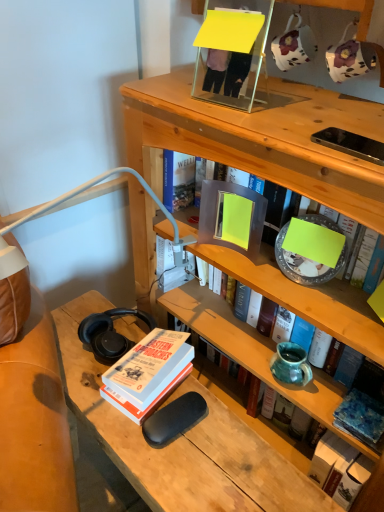
What do you see at coordinates (291, 364) in the screenshot? I see `teal ceramic vase at middle right` at bounding box center [291, 364].

In order to face teal ceramic vase at middle right, should I rotate leftwards or rightwards?

Rotate right and turn 13.394 degrees.

The image size is (384, 512). What do you see at coordinates (361, 417) in the screenshot?
I see `blue textured fabric at lower right, placed as the first book when sorted from bottom to top` at bounding box center [361, 417].

What do you see at coordinates (147, 372) in the screenshot? I see `hardcover book at lower left, which is the 3th book in top-to-bottom order` at bounding box center [147, 372].

What do you see at coordinates (223, 342) in the screenshot?
I see `hardcover book at upper center, which is counted as the 2th book, starting from the top` at bounding box center [223, 342].

Where is `matte gray book at center, arranged as the first book when viewed from the top`? The height and width of the screenshot is (512, 384). matte gray book at center, arranged as the first book when viewed from the top is located at coordinates (153, 168).

From a real-world perspective, is teal ceramic vase at middle right positioned over hardcover book at lower left, which is the 3th book in top-to-bottom order, based on gravity?

Indeed, from a real-world perspective, teal ceramic vase at middle right stands above hardcover book at lower left, which is the 3th book in top-to-bottom order.

From the image's perspective, starting from the teal ceramic vase at middle right, which book is the 1st one below? Please provide its 2D coordinates.

[(147, 372)]

Which is behind, point (279, 344) or point (157, 341)?

Positioned behind is point (279, 344).

Considering the relative positions of hardcover book at lower left, which is the 3th book in top-to-bottom order, and blue textured fabric at lower right, marked as the 4th book in a top-to-bottom arrangement, in the image provided, is hardcover book at lower left, which is the 3th book in top-to-bottom order, in front of blue textured fabric at lower right, marked as the 4th book in a top-to-bottom arrangement,?

No, the depth of hardcover book at lower left, which is the 3th book in top-to-bottom order, is greater than that of blue textured fabric at lower right, marked as the 4th book in a top-to-bottom arrangement.

Which of these two, hardcover book at lower left, acting as the 2th book starting from the bottom, or blue textured fabric at lower right, marked as the 4th book in a top-to-bottom arrangement, stands shorter?

Standing shorter between the two is blue textured fabric at lower right, marked as the 4th book in a top-to-bottom arrangement.

From the image's perspective, who appears lower, hardcover book at lower left, acting as the 2th book starting from the bottom, or blue textured fabric at lower right, placed as the first book when sorted from bottom to top?

blue textured fabric at lower right, placed as the first book when sorted from bottom to top, from the image's perspective.

Is blue textured fabric at lower right, marked as the 4th book in a top-to-bottom arrangement, surrounded by hardcover book at lower left, which is the 3th book in top-to-bottom order?

Actually, blue textured fabric at lower right, marked as the 4th book in a top-to-bottom arrangement, is outside hardcover book at lower left, which is the 3th book in top-to-bottom order.

Is the depth of hardcover book at upper center, which is counted as the 2th book, starting from the top, less than that of teal ceramic vase at middle right?

Yes, hardcover book at upper center, which is counted as the 2th book, starting from the top, is in front of teal ceramic vase at middle right.

Identify the location of vase on the right of hardcover book at upper center, which is the third book in bottom-to-top order. The image size is (384, 512). (291, 364).

Is hardcover book at upper center, which is counted as the 2th book, starting from the top, facing away from teal ceramic vase at middle right?

Yes, hardcover book at upper center, which is counted as the 2th book, starting from the top, is positioned with its back facing teal ceramic vase at middle right.

Is hardcover book at upper center, which is the third book in bottom-to-top order, shorter than teal ceramic vase at middle right?

No, hardcover book at upper center, which is the third book in bottom-to-top order, is not shorter than teal ceramic vase at middle right.

Is hardcover book at lower left, acting as the 2th book starting from the bottom, bigger than hardcover book at upper center, which is counted as the 2th book, starting from the top?

Incorrect, hardcover book at lower left, acting as the 2th book starting from the bottom, is not larger than hardcover book at upper center, which is counted as the 2th book, starting from the top.

Is the position of hardcover book at lower left, acting as the 2th book starting from the bottom, more distant than that of hardcover book at upper center, which is counted as the 2th book, starting from the top?

Yes, hardcover book at lower left, acting as the 2th book starting from the bottom, is further from the camera.

From the image's perspective, which one is positioned lower, hardcover book at lower left, which is the 3th book in top-to-bottom order, or hardcover book at upper center, which is the third book in bottom-to-top order?

hardcover book at lower left, which is the 3th book in top-to-bottom order, appears lower in the image.

Which is closer, (211, 169) or (288, 379)?

The point (288, 379) is closer.

Is matte gray book at center, placed as the 4th book when sorted from bottom to top, not near teal ceramic vase at middle right?

They are positioned close to each other.

Could teal ceramic vase at middle right be considered to be inside matte gray book at center, placed as the 4th book when sorted from bottom to top?

Definitely not — teal ceramic vase at middle right is not inside matte gray book at center, placed as the 4th book when sorted from bottom to top.

You are a GUI agent. You are given a task and a screenshot of the screen. Output one action in this format:
    pyautogui.click(x=<x>, y=<y>)
    Task: Click on the vase below the matte gray book at center, placed as the 4th book when sorted from bottom to top (from the image's perspective)
    The width and height of the screenshot is (384, 512).
    Given the screenshot: What is the action you would take?
    pyautogui.click(x=291, y=364)

From the image's perspective, count 3rd books downward from the matte gray book at center, placed as the 4th book when sorted from bottom to top, and point to it. Please provide its 2D coordinates.

[(361, 417)]

Is blue textured fabric at lower right, placed as the first book when sorted from bottom to top, far away from matte gray book at center, placed as the 4th book when sorted from bottom to top?

Actually, blue textured fabric at lower right, placed as the first book when sorted from bottom to top, and matte gray book at center, placed as the 4th book when sorted from bottom to top, are a little close together.

Which is in front, blue textured fabric at lower right, marked as the 4th book in a top-to-bottom arrangement, or matte gray book at center, arranged as the first book when viewed from the top?

Positioned in front is matte gray book at center, arranged as the first book when viewed from the top.

Is blue textured fabric at lower right, marked as the 4th book in a top-to-bottom arrangement, not inside matte gray book at center, arranged as the first book when viewed from the top?

Yes, blue textured fabric at lower right, marked as the 4th book in a top-to-bottom arrangement, is outside of matte gray book at center, arranged as the first book when viewed from the top.

Considering the sizes of objects matte gray book at center, placed as the 4th book when sorted from bottom to top, and hardcover book at lower left, acting as the 2th book starting from the bottom, in the image provided, who is shorter, matte gray book at center, placed as the 4th book when sorted from bottom to top, or hardcover book at lower left, acting as the 2th book starting from the bottom,?

hardcover book at lower left, acting as the 2th book starting from the bottom.

Who is bigger, matte gray book at center, placed as the 4th book when sorted from bottom to top, or hardcover book at lower left, acting as the 2th book starting from the bottom?

matte gray book at center, placed as the 4th book when sorted from bottom to top.

Considering the positions of point (154, 186) and point (161, 373), is point (154, 186) closer or farther from the camera than point (161, 373)?

Point (154, 186) appears to be farther away from the viewer than point (161, 373).

Is hardcover book at lower left, which is the 3th book in top-to-bottom order, surrounded by matte gray book at center, placed as the 4th book when sorted from bottom to top?

Actually, hardcover book at lower left, which is the 3th book in top-to-bottom order, is outside matte gray book at center, placed as the 4th book when sorted from bottom to top.

Find the location of a particular element. The height and width of the screenshot is (512, 384). book that is the 3rd one when counting leftward from the teal ceramic vase at middle right is located at coordinates (147, 372).

Identify the location of book lying behind the blue textured fabric at lower right, placed as the first book when sorted from bottom to top. Image resolution: width=384 pixels, height=512 pixels. (147, 372).

Considering their positions, is hardcover book at upper center, which is counted as the 2th book, starting from the top, positioned closer to teal ceramic vase at middle right than matte gray book at center, arranged as the first book when viewed from the top?

hardcover book at upper center, which is counted as the 2th book, starting from the top, is closer to teal ceramic vase at middle right.

From the image, which object appears to be farther from hardcover book at lower left, acting as the 2th book starting from the bottom, hardcover book at upper center, which is counted as the 2th book, starting from the top, or teal ceramic vase at middle right?

Among the two, hardcover book at upper center, which is counted as the 2th book, starting from the top, is located further to hardcover book at lower left, acting as the 2th book starting from the bottom.

Looking at the image, which one is located closer to hardcover book at upper center, which is counted as the 2th book, starting from the top, blue textured fabric at lower right, placed as the first book when sorted from bottom to top, or teal ceramic vase at middle right?

Among the two, teal ceramic vase at middle right is located nearer to hardcover book at upper center, which is counted as the 2th book, starting from the top.

When comparing their distances from matte gray book at center, arranged as the first book when viewed from the top, does blue textured fabric at lower right, marked as the 4th book in a top-to-bottom arrangement, or hardcover book at upper center, which is the third book in bottom-to-top order, seem closer?

hardcover book at upper center, which is the third book in bottom-to-top order, lies closer to matte gray book at center, arranged as the first book when viewed from the top, than the other object.

Estimate the real-world distances between objects in this image. Which object is further from hardcover book at upper center, which is the third book in bottom-to-top order, hardcover book at lower left, which is the 3th book in top-to-bottom order, or matte gray book at center, placed as the 4th book when sorted from bottom to top?

hardcover book at lower left, which is the 3th book in top-to-bottom order, is positioned further to the anchor hardcover book at upper center, which is the third book in bottom-to-top order.

Considering their positions, is hardcover book at lower left, acting as the 2th book starting from the bottom, positioned further to matte gray book at center, arranged as the first book when viewed from the top, than teal ceramic vase at middle right?

teal ceramic vase at middle right lies further to matte gray book at center, arranged as the first book when viewed from the top, than the other object.

Which object lies nearer to the anchor point matte gray book at center, arranged as the first book when viewed from the top, teal ceramic vase at middle right or blue textured fabric at lower right, placed as the first book when sorted from bottom to top?

teal ceramic vase at middle right.

From the image, which object appears to be farther from blue textured fabric at lower right, marked as the 4th book in a top-to-bottom arrangement, hardcover book at lower left, acting as the 2th book starting from the bottom, or hardcover book at upper center, which is the third book in bottom-to-top order?

hardcover book at lower left, acting as the 2th book starting from the bottom, is further to blue textured fabric at lower right, marked as the 4th book in a top-to-bottom arrangement.

You are a GUI agent. You are given a task and a screenshot of the screen. Output one action in this format:
    pyautogui.click(x=<x>, y=<y>)
    Task: Click on the vase between matte gray book at center, arranged as the first book when viewed from the top, and hardcover book at lower left, acting as the 2th book starting from the bottom, in the vertical direction
    
    Given the screenshot: What is the action you would take?
    pyautogui.click(x=291, y=364)

At what (x,y) coordinates should I click in order to perform the action: click on book between matte gray book at center, arranged as the first book when viewed from the top, and hardcover book at lower left, which is the 3th book in top-to-bottom order, from top to bottom. Please return your answer as a coordinate pair (x, y). The width and height of the screenshot is (384, 512). Looking at the image, I should click on (223, 342).

The width and height of the screenshot is (384, 512). Identify the location of vase between matte gray book at center, arranged as the first book when viewed from the top, and blue textured fabric at lower right, placed as the first book when sorted from bottom to top, from top to bottom. (291, 364).

At what (x,y) coordinates should I click in order to perform the action: click on book between matte gray book at center, arranged as the first book when viewed from the top, and teal ceramic vase at middle right from top to bottom. Please return your answer as a coordinate pair (x, y). This screenshot has height=512, width=384. Looking at the image, I should click on (223, 342).